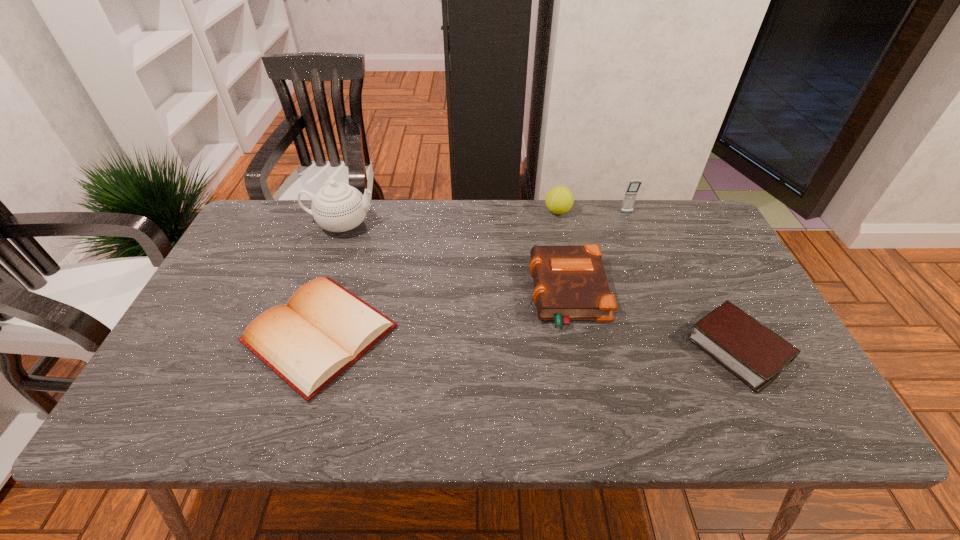
This screenshot has height=540, width=960. Find the location of `free space located 0.210m on the spout of the tallest object`. free space located 0.210m on the spout of the tallest object is located at coordinates (444, 224).

In order to click on vacant space located 0.060m on the front-facing side of the cellular telephone in this screenshot , I will do `click(632, 226)`.

The width and height of the screenshot is (960, 540). What are the coordinates of `vacant space situated 0.210m on the left of the tennis ball` in the screenshot? It's located at (480, 211).

Find the location of a particular element. The image size is (960, 540). vacant space situated on the spine side of the second Bible from left to right is located at coordinates (449, 294).

You are a GUI agent. You are given a task and a screenshot of the screen. Output one action in this format:
    pyautogui.click(x=<x>, y=<y>)
    Task: Click on the free space located 0.050m on the spine side of the second Bible from left to right
    
    Given the screenshot: What is the action you would take?
    pyautogui.click(x=513, y=294)

Identify the location of free spot located 0.100m on the spine side of the second Bible from left to right. This screenshot has height=540, width=960. (493, 294).

This screenshot has height=540, width=960. I want to click on vacant space positioned on the back of the rightmost object, so click(703, 279).

In order to click on vacant point located on the back of the leftmost Bible in this screenshot , I will do `click(354, 227)`.

Where is `chinaware positioned at the far edge`? chinaware positioned at the far edge is located at coordinates 338,207.

This screenshot has height=540, width=960. I want to click on cellular telephone that is at the far edge, so click(629, 199).